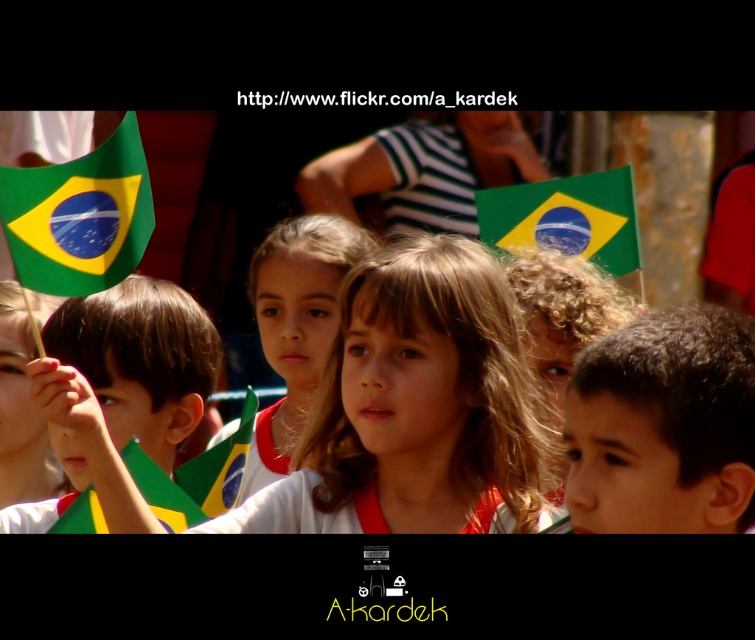
Question: In this image, where is green felt flag at left located relative to matte white shirt at center?

Choices:
 (A) above
 (B) below

Answer: (A)

Question: Which point appears farthest from the camera in this image?

Choices:
 (A) (116, 362)
 (B) (282, 296)

Answer: (B)

Question: Which object appears farthest from the camera in this image?

Choices:
 (A) matte white shirt at center
 (B) green-yellow fabric flag at lower left
 (C) matte green flag at left

Answer: (A)

Question: Which object appears farthest from the camera in this image?

Choices:
 (A) green fabric flag at center
 (B) green fabric flag at upper center

Answer: (B)

Question: Where is green felt flag at left located in relation to matte white shirt at center in the image?

Choices:
 (A) below
 (B) above

Answer: (B)

Question: Does green felt flag at left have a larger size compared to green fabric flag at upper center?

Choices:
 (A) yes
 (B) no

Answer: (B)